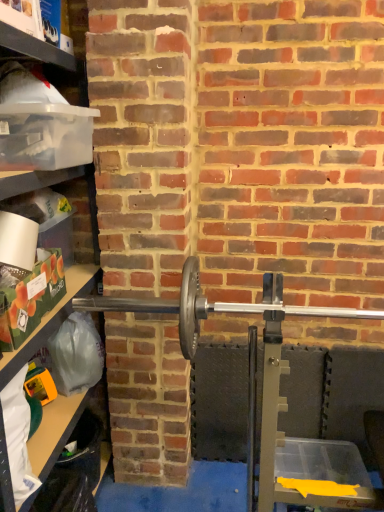
Question: Is polished silver barbell at center wider than clear plastic container at left?

Choices:
 (A) no
 (B) yes

Answer: (A)

Question: Is the position of polished silver barbell at center more distant than that of clear plastic container at left?

Choices:
 (A) yes
 (B) no

Answer: (A)

Question: Can you confirm if polished silver barbell at center is positioned to the right of clear plastic container at left?

Choices:
 (A) no
 (B) yes

Answer: (B)

Question: Is polished silver barbell at center outside clear plastic container at left?

Choices:
 (A) no
 (B) yes

Answer: (B)

Question: Is polished silver barbell at center to the left of clear plastic container at left from the viewer's perspective?

Choices:
 (A) no
 (B) yes

Answer: (A)

Question: Does polished silver barbell at center have a lesser width compared to clear plastic container at left?

Choices:
 (A) no
 (B) yes

Answer: (B)

Question: Is the depth of clear plastic container at left greater than that of polished silver barbell at center?

Choices:
 (A) yes
 (B) no

Answer: (B)

Question: Is clear plastic container at left positioned before polished silver barbell at center?

Choices:
 (A) no
 (B) yes

Answer: (B)

Question: From the image's perspective, would you say clear plastic container at left is positioned over polished silver barbell at center?

Choices:
 (A) no
 (B) yes

Answer: (A)

Question: Would you say clear plastic container at left contains polished silver barbell at center?

Choices:
 (A) no
 (B) yes

Answer: (A)

Question: Could you tell me if clear plastic container at left is facing polished silver barbell at center?

Choices:
 (A) yes
 (B) no

Answer: (A)

Question: Can you confirm if clear plastic container at left is positioned to the left of polished silver barbell at center?

Choices:
 (A) no
 (B) yes

Answer: (B)

Question: In the image, is polished silver barbell at center positioned in front of or behind clear plastic container at left?

Choices:
 (A) front
 (B) behind

Answer: (B)